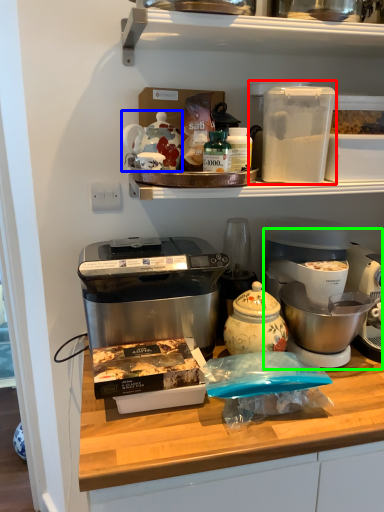
Question: Which object is positioned farthest from appliance (highlighted by a red box)? Select from appliance (highlighted by a blue box) and coffee maker (highlighted by a green box).

Choices:
 (A) appliance
 (B) coffee maker

Answer: (B)